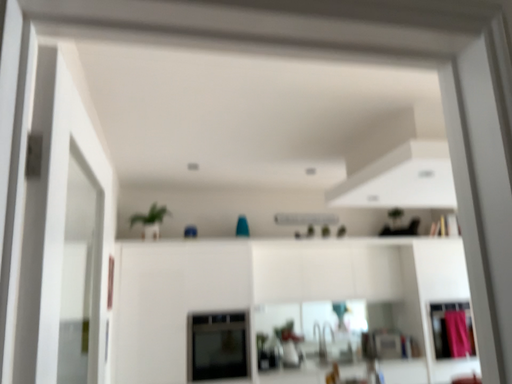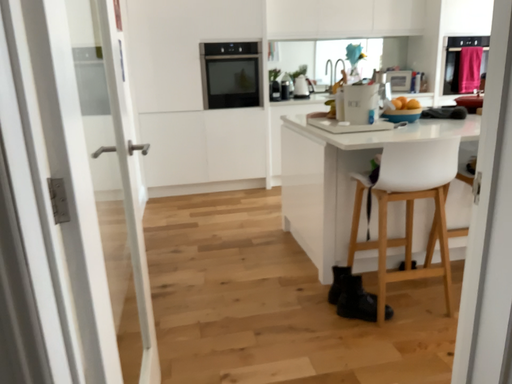
Question: Which way did the camera rotate in the video?

Choices:
 (A) rotated downward
 (B) rotated upward

Answer: (A)